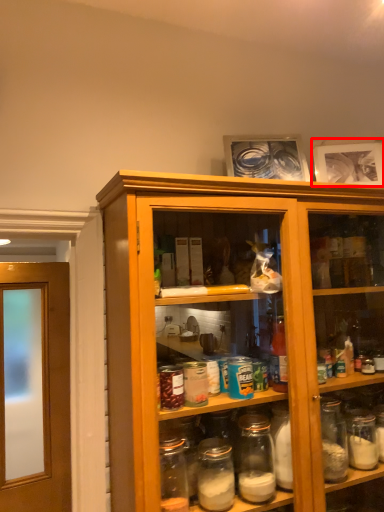
Question: In this image, where is picture frame (annotated by the red box) located relative to picture frame?

Choices:
 (A) left
 (B) right

Answer: (B)